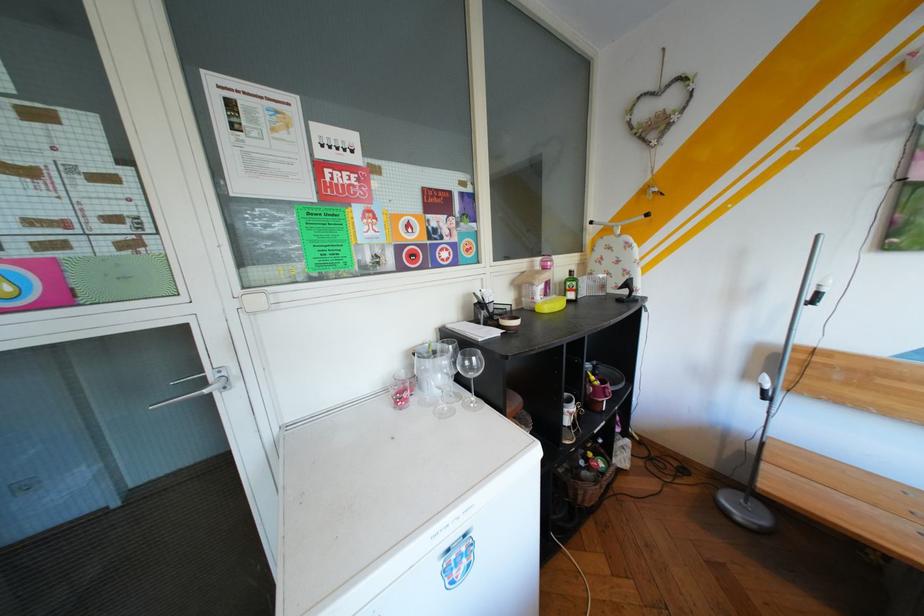
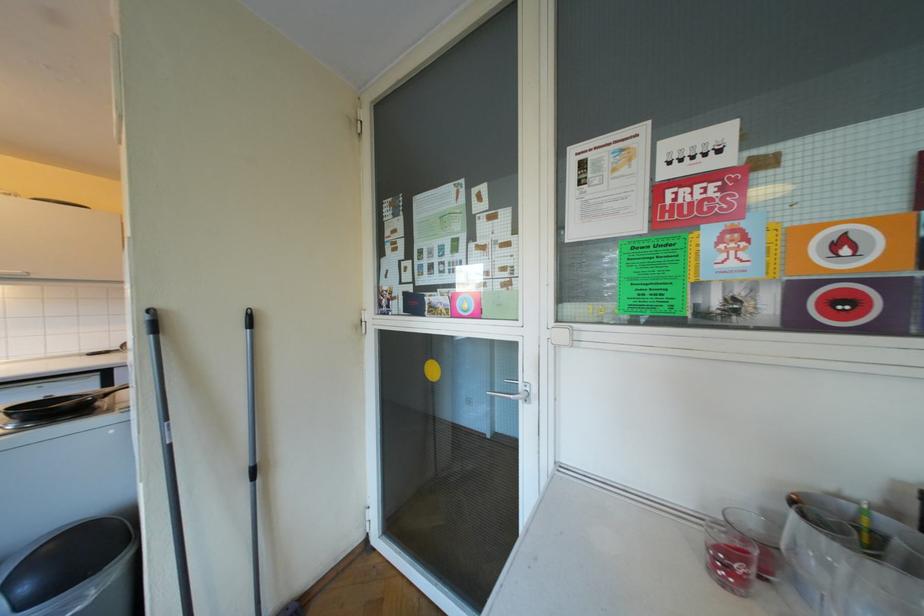
Where in the second image is the point corresponding to point (418, 394) from the first image?

(752, 567)